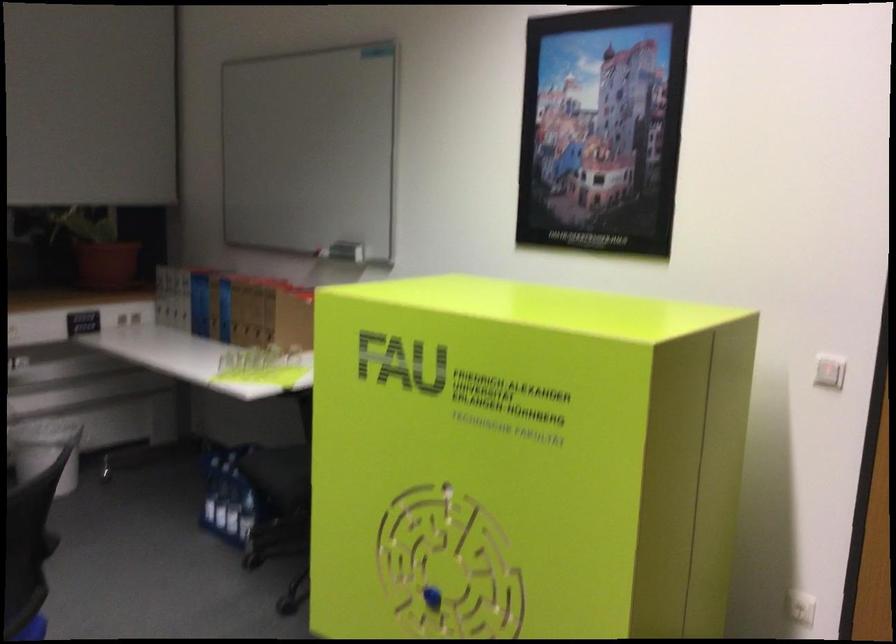
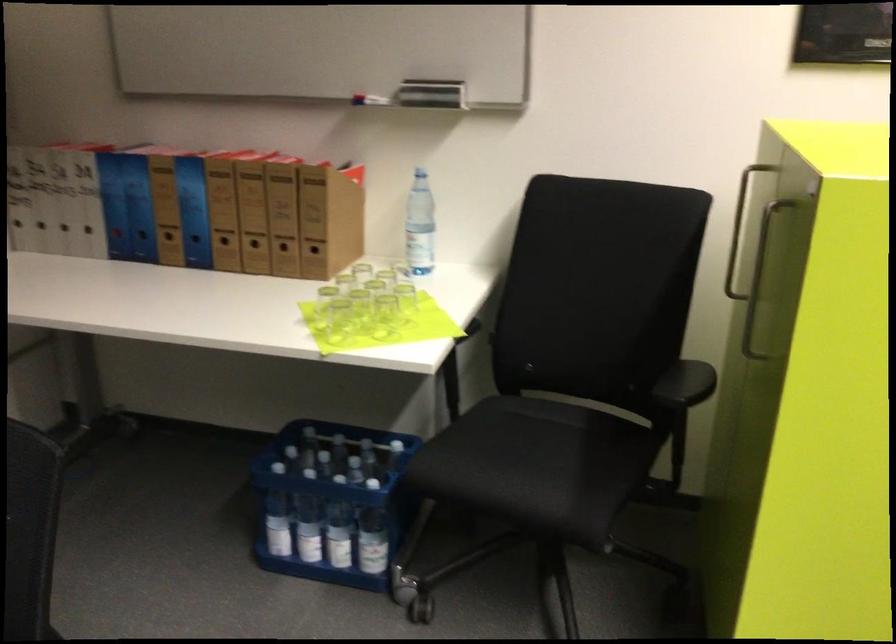
In the second image, find the point that corresponds to pixel 269 373 in the first image.

(383, 316)